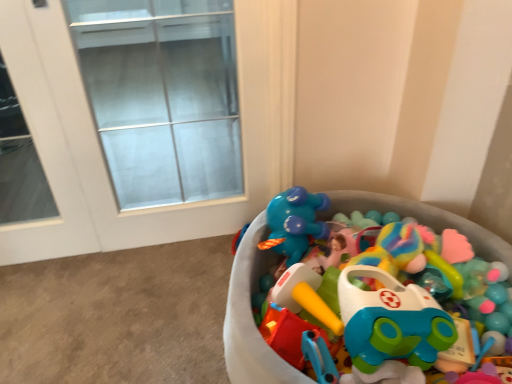
Question: From the image's perspective, is transparent glass door at upper left above or below plastic toy car at center?

Choices:
 (A) below
 (B) above

Answer: (B)

Question: Is transparent glass door at upper left inside the boundaries of plastic toy car at center, or outside?

Choices:
 (A) outside
 (B) inside

Answer: (A)

Question: In terms of width, does transparent glass door at upper left look wider or thinner when compared to plastic toy car at center?

Choices:
 (A) wide
 (B) thin

Answer: (B)

Question: Does point (273, 380) appear closer or farther from the camera than point (84, 77)?

Choices:
 (A) closer
 (B) farther

Answer: (A)

Question: From a real-world perspective, is plastic toy car at center positioned above or below transparent glass door at upper left?

Choices:
 (A) above
 (B) below

Answer: (B)

Question: Relative to transparent glass door at upper left, is plastic toy car at center in front or behind?

Choices:
 (A) front
 (B) behind

Answer: (A)

Question: Looking at their shapes, would you say plastic toy car at center is wider or thinner than transparent glass door at upper left?

Choices:
 (A) wide
 (B) thin

Answer: (A)